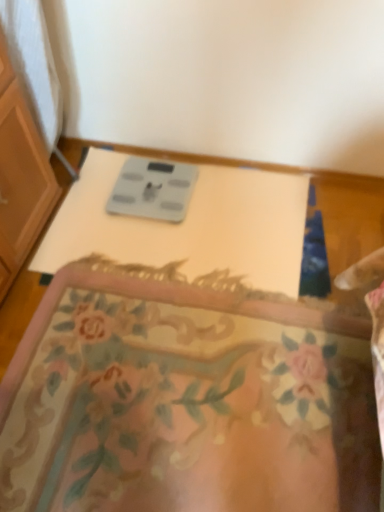
Image resolution: width=384 pixels, height=512 pixels. What are the coordinates of `space that is in front of gray matte scale at center` in the screenshot? It's located at (158, 243).